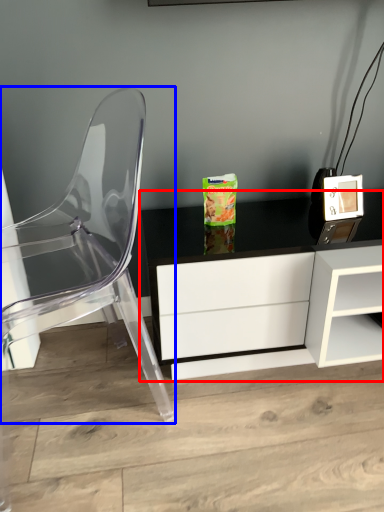
Question: Which of the following is the closest to the observer, table (highlighted by a red box) or chair (highlighted by a blue box)?

Choices:
 (A) table
 (B) chair

Answer: (B)